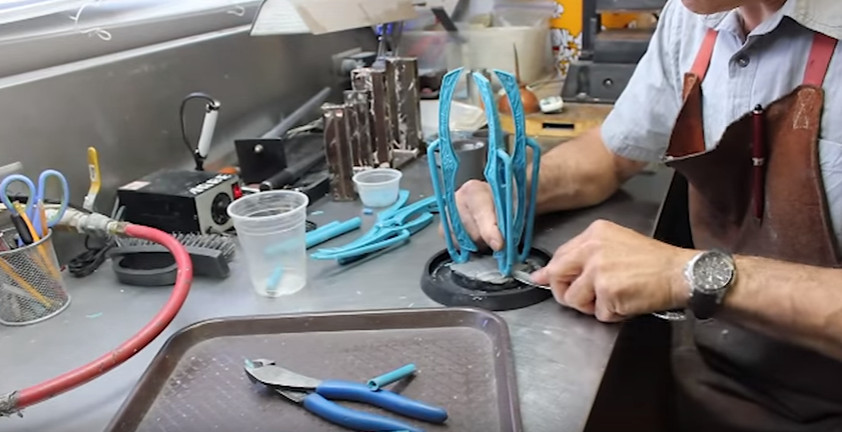
Locate an element on the screen. counter is located at coordinates (533, 349).